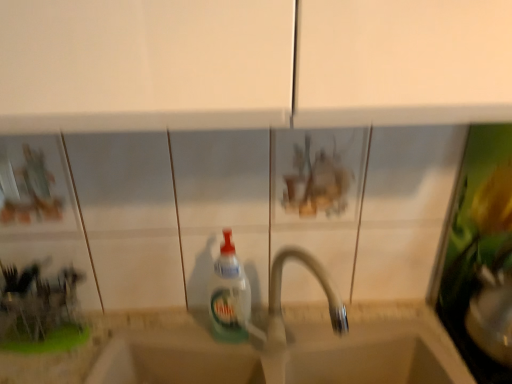
Where is `vacant point above beige stone sink at center (from a real-world perspective)`? vacant point above beige stone sink at center (from a real-world perspective) is located at coordinates (262, 322).